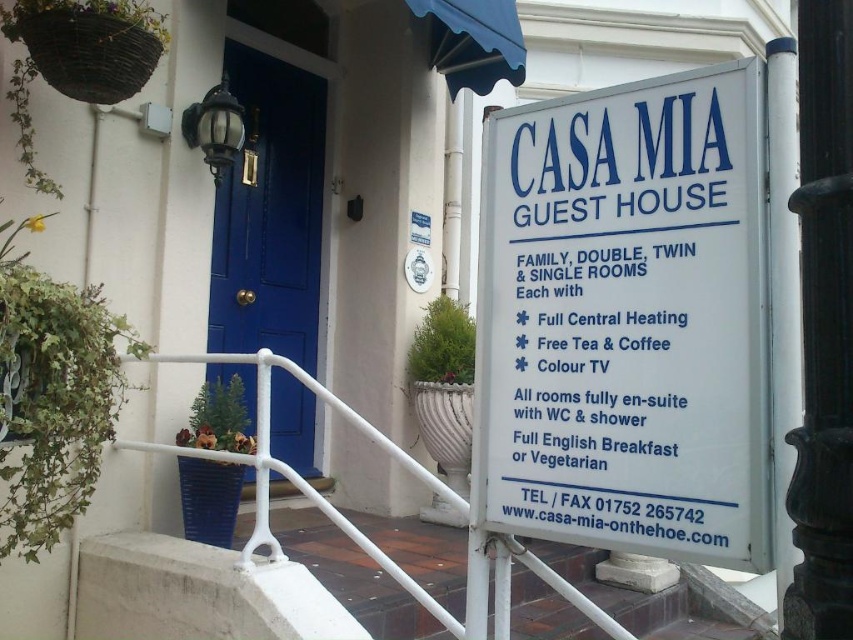
From the picture: You are a guest arriving at Casa Mia Guest House. You notice the white plastic sign at right and the matte blue door at center. Which object has a greater width?

The white plastic sign at right has a greater width than the matte blue door at center.

You are a guest arriving at Casa Mia Guest House and need to locate the entrance. You see the white plastic sign at right and the matte blue door at center. Which object is shorter?

The white plastic sign at right is shorter than the matte blue door at center.

You are a guest arriving at Casa Mia Guest House and need to read the white plastic sign at right. Can you easily read it while standing next to the black polished metal pole at right?

The white plastic sign at right has a larger size compared to the black polished metal pole at right, so yes, you can easily read the white plastic sign at right while standing next to the black polished metal pole at right because its larger size makes the text more legible from a closer distance.